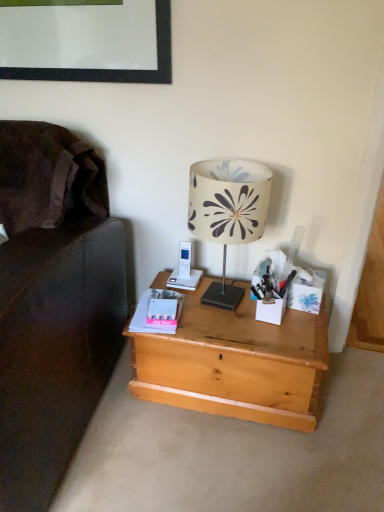
Question: From the image's perspective, is white matte stationery at right beneath matte pink paperback book at center-left?

Choices:
 (A) no
 (B) yes

Answer: (A)

Question: Can you confirm if white matte stationery at right is taller than matte pink paperback book at center-left?

Choices:
 (A) yes
 (B) no

Answer: (A)

Question: From the image's perspective, does white matte stationery at right appear higher than matte pink paperback book at center-left?

Choices:
 (A) yes
 (B) no

Answer: (A)

Question: Can you see white matte stationery at right touching matte pink paperback book at center-left?

Choices:
 (A) yes
 (B) no

Answer: (B)

Question: Is matte pink paperback book at center-left surrounded by white matte stationery at right?

Choices:
 (A) no
 (B) yes

Answer: (A)

Question: Does white matte stationery at right have a larger size compared to matte pink paperback book at center-left?

Choices:
 (A) yes
 (B) no

Answer: (A)

Question: From a real-world perspective, is white fabric lampshade at center on top of matte pink paperback book at center-left?

Choices:
 (A) no
 (B) yes

Answer: (B)

Question: From the image's perspective, is white fabric lampshade at center under matte pink paperback book at center-left?

Choices:
 (A) yes
 (B) no

Answer: (B)

Question: Can we say white fabric lampshade at center lies outside matte pink paperback book at center-left?

Choices:
 (A) yes
 (B) no

Answer: (A)

Question: Is white fabric lampshade at center positioned before matte pink paperback book at center-left?

Choices:
 (A) yes
 (B) no

Answer: (A)

Question: Considering the relative positions of white fabric lampshade at center and matte pink paperback book at center-left in the image provided, is white fabric lampshade at center to the right of matte pink paperback book at center-left from the viewer's perspective?

Choices:
 (A) no
 (B) yes

Answer: (B)

Question: Does white fabric lampshade at center have a greater width compared to matte pink paperback book at center-left?

Choices:
 (A) no
 (B) yes

Answer: (B)

Question: From the image's perspective, does matte pink paperback book at center-left appear higher than natural wood desk at center?

Choices:
 (A) no
 (B) yes

Answer: (B)